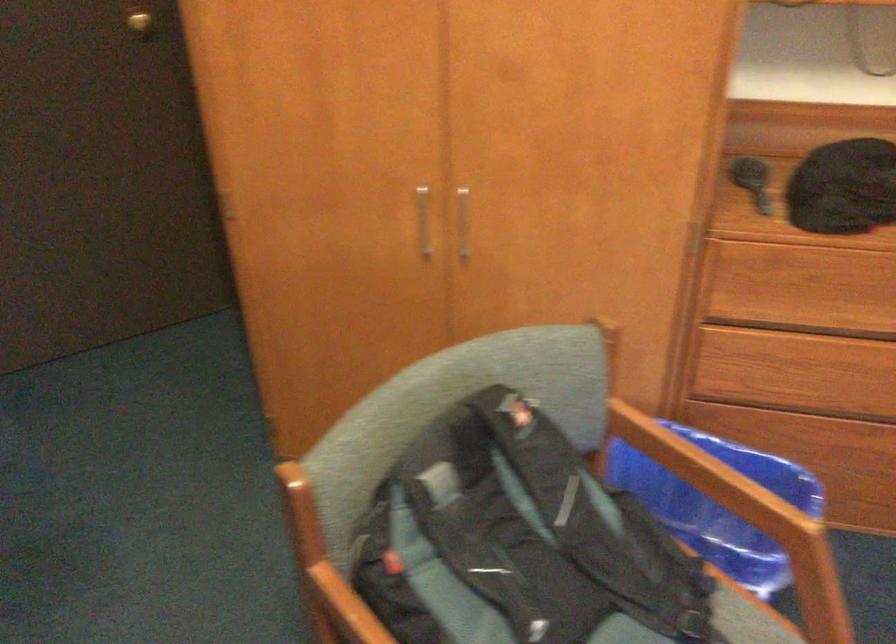
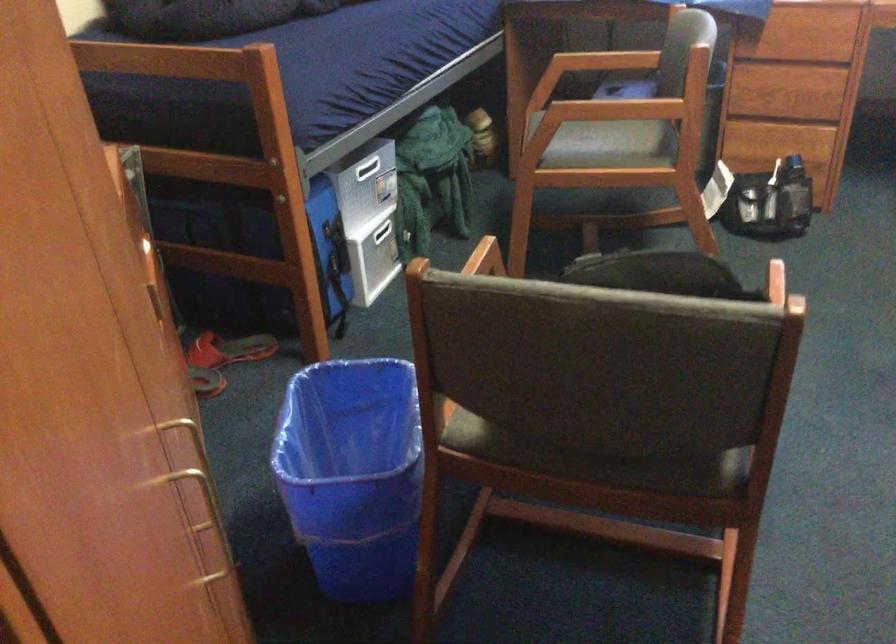
Where in the second image is the point corresponding to [407,221] from the first image?

(199, 494)